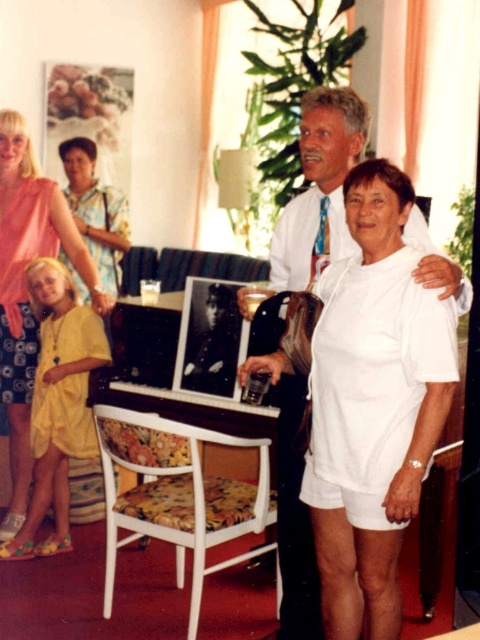
You are attending a social event and want to take a photo of both the yellow cotton dress at lower left and the matte pink blouse at upper left. Which one should you focus on first if you want to capture them both in the same frame?

The yellow cotton dress at lower left is located below the matte pink blouse at upper left, so you should focus on the matte pink blouse at upper left first to ensure both are in the same frame.

You are organizing a charity event and need to decide which outfit to display first. Given the yellow cotton dress at lower left and the matte pink blouse at upper left, which one is smaller in size?

The yellow cotton dress at lower left has a smaller size compared to the matte pink blouse at upper left, so it should be displayed first.

You are standing in the room and want to take a photo of the white cotton shirt at center. Where should you position yourself to capture it in the frame?

To capture the white cotton shirt at center in the frame, position yourself facing the center of the room, as the white cotton shirt at center is located at the coordinates point [316,193].